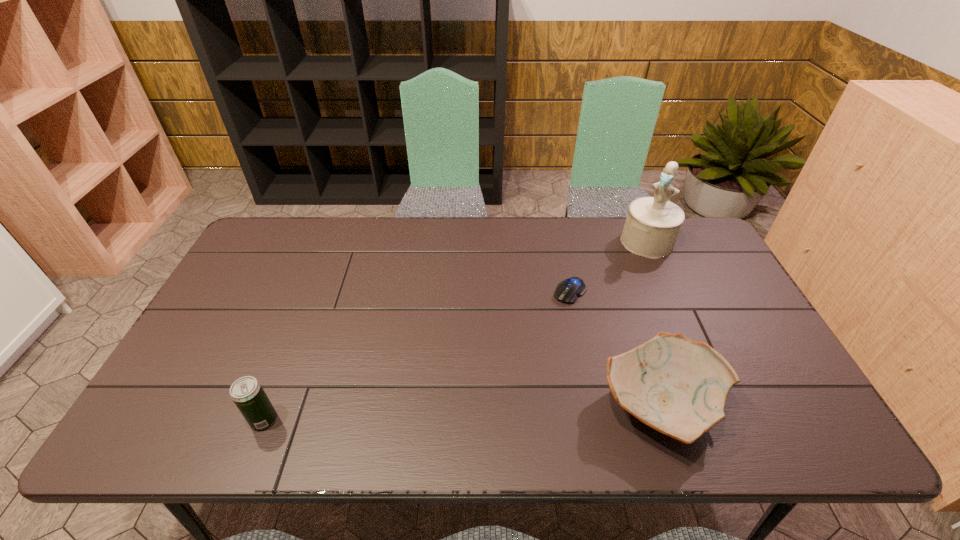
What are the coordinates of `the leftmost object` in the screenshot? It's located at (246, 392).

The image size is (960, 540). Find the location of `the second shortest object`. the second shortest object is located at coordinates (677, 386).

The width and height of the screenshot is (960, 540). Find the location of `figurine`. figurine is located at coordinates (652, 226).

The height and width of the screenshot is (540, 960). Find the location of `the farthest object`. the farthest object is located at coordinates (652, 226).

Image resolution: width=960 pixels, height=540 pixels. In order to click on the third nearest object in this screenshot , I will do `click(567, 291)`.

The width and height of the screenshot is (960, 540). I want to click on computer mouse, so click(x=567, y=291).

The image size is (960, 540). Identify the location of free point located 0.270m on the back of the leftmost object. (302, 321).

This screenshot has height=540, width=960. Identify the location of free space located 0.360m on the left of the third tallest object. (445, 407).

At what (x,y) coordinates should I click in order to perform the action: click on vacant space located 0.230m at the beak of the figurine. Please return your answer as a coordinate pair (x, y). The image size is (960, 540). Looking at the image, I should click on (606, 295).

This screenshot has height=540, width=960. I want to click on free spot located 0.070m at the beak of the figurine, so 628,266.